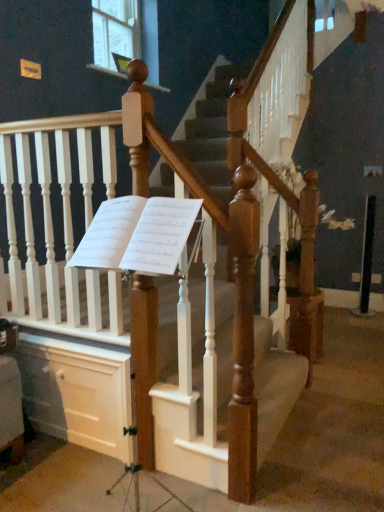
Question: Considering their positions, is clear glass window at upper center located in front of or behind wooden staircase at center?

Choices:
 (A) front
 (B) behind

Answer: (B)

Question: From a real-world perspective, is clear glass window at upper center above or below wooden staircase at center?

Choices:
 (A) below
 (B) above

Answer: (B)

Question: Estimate the real-world distances between objects in this image. Which object is farther from the white painted wood drawer at lower left?

Choices:
 (A) white paper sheet music at center
 (B) clear glass window at upper center
 (C) wooden staircase at center

Answer: (B)

Question: Estimate the real-world distances between objects in this image. Which object is closer to the white painted wood drawer at lower left?

Choices:
 (A) white paper sheet music at center
 (B) clear glass window at upper center
 (C) wooden staircase at center

Answer: (C)